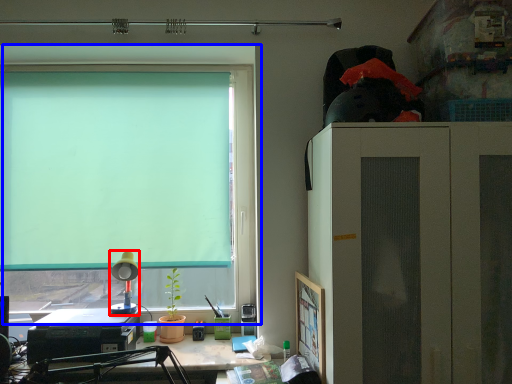
Question: Which object is closer to the camera taking this photo, lamp (highlighted by a red box) or window (highlighted by a blue box)?

Choices:
 (A) lamp
 (B) window

Answer: (A)